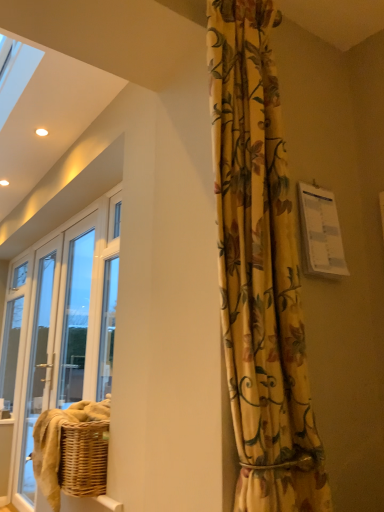
Question: Does point (273, 140) appear closer or farther from the camera than point (38, 259)?

Choices:
 (A) farther
 (B) closer

Answer: (B)

Question: From the image's perspective, relative to clear glass screen door at left, is floral yellow curtain at center above or below?

Choices:
 (A) above
 (B) below

Answer: (A)

Question: From a real-world perspective, is floral yellow curtain at center positioned above or below clear glass screen door at left?

Choices:
 (A) below
 (B) above

Answer: (B)

Question: Is clear glass screen door at left to the left or to the right of floral yellow curtain at center in the image?

Choices:
 (A) right
 (B) left

Answer: (B)

Question: Looking at their shapes, would you say clear glass screen door at left is wider or thinner than floral yellow curtain at center?

Choices:
 (A) thin
 (B) wide

Answer: (A)

Question: From their relative heights in the image, would you say clear glass screen door at left is taller or shorter than floral yellow curtain at center?

Choices:
 (A) short
 (B) tall

Answer: (B)

Question: Is clear glass screen door at left inside or outside of floral yellow curtain at center?

Choices:
 (A) inside
 (B) outside

Answer: (B)